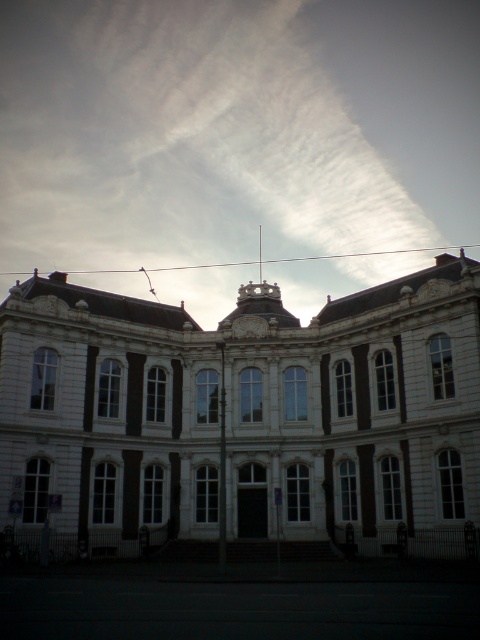
You are an architect analyzing the building facade. You notice the white cotton cloud at upper center and the matte white clock at center. Which object appears higher in the sky?

The white cotton cloud at upper center appears higher in the sky than the matte white clock at center because it is positioned above it.

You are standing in front of the grand classical building and want to take a photo of the matte white clock at center. Since the white stone building at center is in the way, can you move around it to get a clear shot? Explain your reasoning based on their positions.

The white stone building at center is closer to the viewer than the matte white clock at center. Therefore, moving around the building might allow you to position yourself where the building no longer blocks the view of the clock, as the clock is further back. However, the exact path would depend on the building layout and surrounding space.